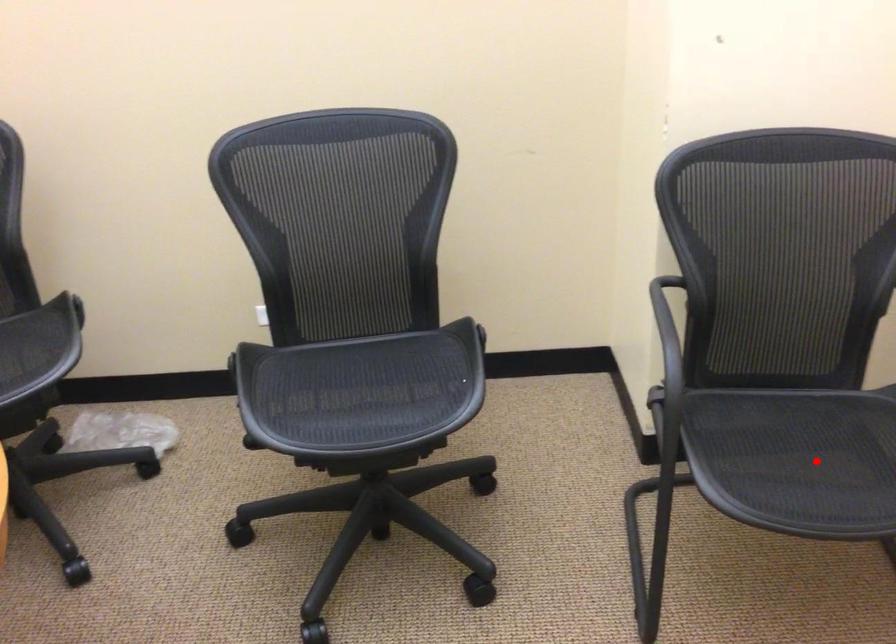
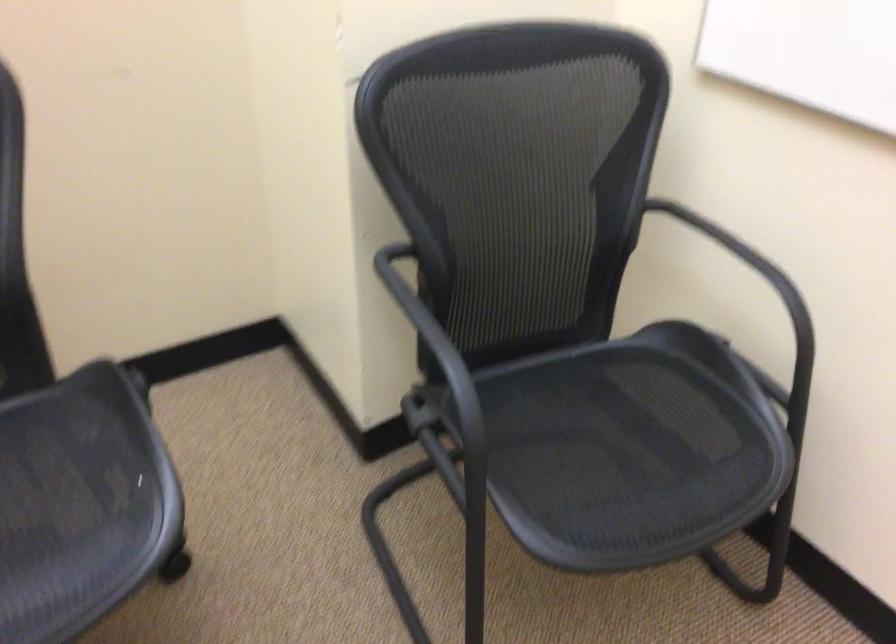
Where in the second image is the point corresponding to the highlighted location from the first image?

(626, 453)